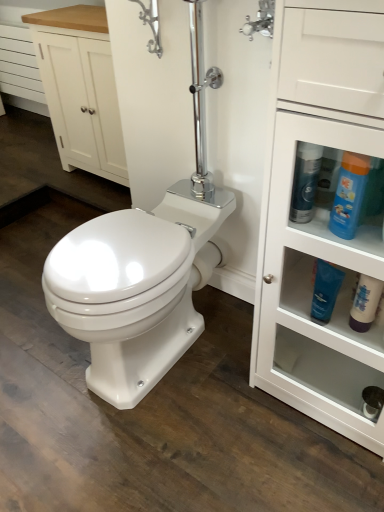
The image size is (384, 512). In order to click on free space in front of white glossy cabinet at right in this screenshot , I will do `click(310, 470)`.